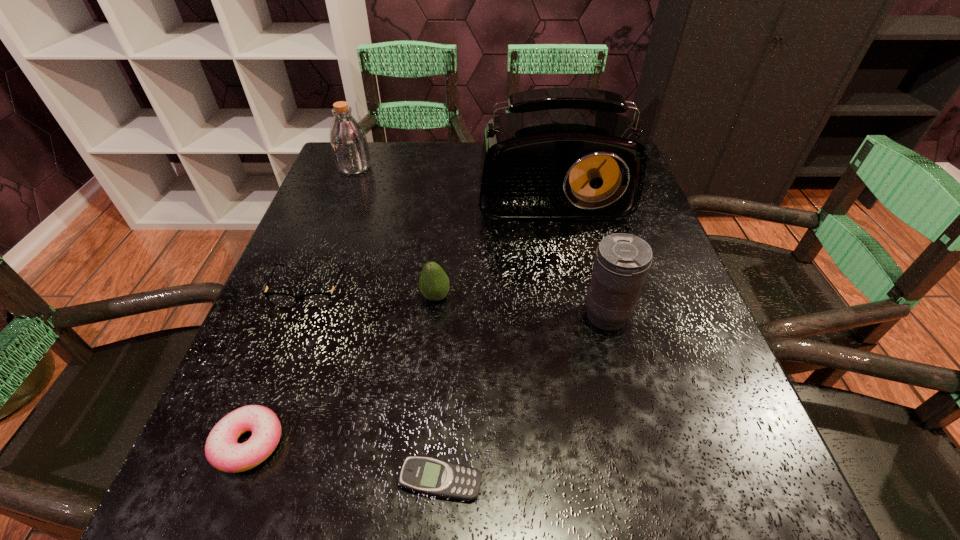
In order to click on vacant region at the left edge of the desktop in this screenshot , I will do `click(236, 407)`.

At what (x,y) coordinates should I click in order to perform the action: click on free space at the right edge. Please return your answer as a coordinate pair (x, y). The image size is (960, 540). Looking at the image, I should click on (713, 344).

Locate an element on the screen. Image resolution: width=960 pixels, height=540 pixels. vacant space at the far left corner of the desktop is located at coordinates (381, 141).

This screenshot has width=960, height=540. Find the location of `free space at the near left corner of the desktop`. free space at the near left corner of the desktop is located at coordinates (205, 495).

Where is `vacant space at the near right corner`? vacant space at the near right corner is located at coordinates (742, 480).

This screenshot has height=540, width=960. I want to click on unoccupied area between the doughnut and the tallest object, so click(399, 310).

Where is `free spot between the bottle and the avocado`? The height and width of the screenshot is (540, 960). free spot between the bottle and the avocado is located at coordinates (395, 232).

The image size is (960, 540). Find the location of `vacant region between the spectacles and the fourth tallest object`. vacant region between the spectacles and the fourth tallest object is located at coordinates (372, 293).

The image size is (960, 540). Identify the location of unoccupied position between the doughnut and the bottle. [x=301, y=305].

The height and width of the screenshot is (540, 960). Find the location of `vacant area that lies between the spectacles and the bottle`. vacant area that lies between the spectacles and the bottle is located at coordinates (332, 228).